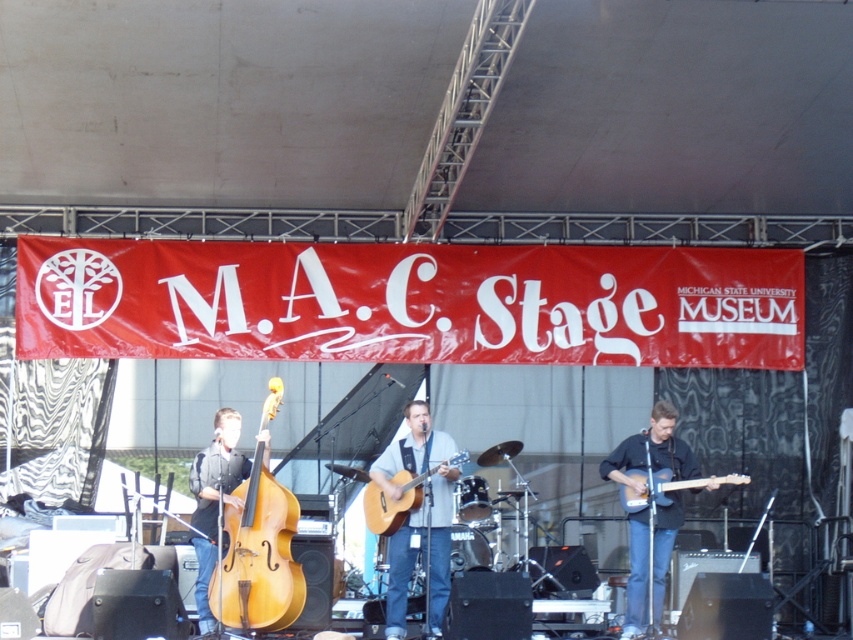
Between dark blue jeans at center and acoustic wood guitar at center, which one has less height?

Standing shorter between the two is acoustic wood guitar at center.

Does dark blue jeans at center have a lesser height compared to acoustic wood guitar at center?

No.

What do you see at coordinates (650, 452) in the screenshot? Image resolution: width=853 pixels, height=640 pixels. I see `dark blue jeans at center` at bounding box center [650, 452].

Find the location of a particular element. Image resolution: width=853 pixels, height=640 pixels. dark blue jeans at center is located at coordinates (650, 452).

Is light brown wood cello at center shorter than acoustic wood guitar at center?

No, light brown wood cello at center is not shorter than acoustic wood guitar at center.

Is light brown wood cello at center below acoustic wood guitar at center?

Yes, light brown wood cello at center is below acoustic wood guitar at center.

Who is more distant from viewer, (293,568) or (408,484)?

Point (408,484)

Identify the location of light brown wood cello at center. (258, 556).

In the scene shown: Who is positioned more to the right, light brown wood cello at center or light brown wood electric guitar at center?

From the viewer's perspective, light brown wood electric guitar at center appears more on the right side.

This screenshot has width=853, height=640. Describe the element at coordinates (258, 556) in the screenshot. I see `light brown wood cello at center` at that location.

The width and height of the screenshot is (853, 640). I want to click on light brown wood cello at center, so click(258, 556).